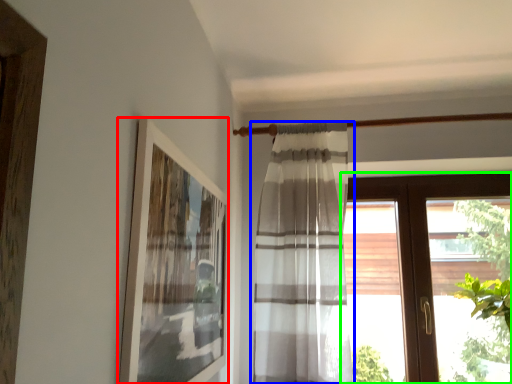
Question: Considering the real-world distances, which object is farthest from picture frame (highlighted by a red box)? curtain (highlighted by a blue box) or window (highlighted by a green box)?

Choices:
 (A) curtain
 (B) window

Answer: (B)